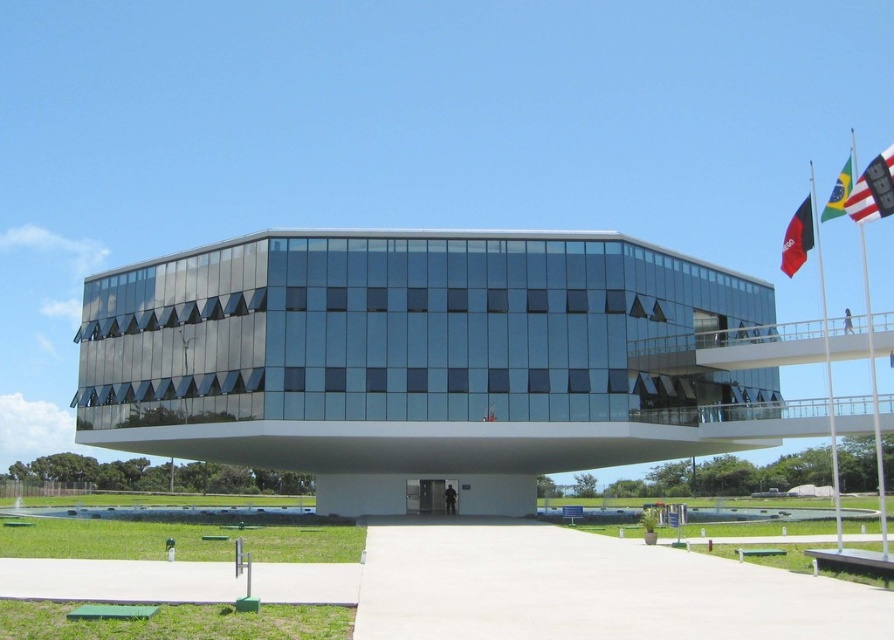
Between white fabric flag at upper right and green fabric flag at upper right, which one is positioned higher?

Positioned higher is white fabric flag at upper right.

Is point (859, 218) more distant than point (850, 182)?

That is False.

At what (x,y) coordinates should I click in order to perform the action: click on white fabric flag at upper right. Please return your answer as a coordinate pair (x, y). The height and width of the screenshot is (640, 894). Looking at the image, I should click on (873, 189).

Is black flagpole at right wider than green fabric flag at upper right?

No, black flagpole at right is not wider than green fabric flag at upper right.

Is point (833, 429) farther from viewer compared to point (842, 204)?

Yes, point (833, 429) is behind point (842, 204).

What are the coordinates of `black flagpole at right` in the screenshot? It's located at (825, 353).

Looking at this image, is black flagpole at right smaller than black fabric flag at upper right?

Incorrect, black flagpole at right is not smaller in size than black fabric flag at upper right.

Locate an element on the screen. black flagpole at right is located at coordinates click(x=825, y=353).

Where is `black flagpole at right`? black flagpole at right is located at coordinates (825, 353).

Locate an element on the screen. The height and width of the screenshot is (640, 894). black flagpole at right is located at coordinates (825, 353).